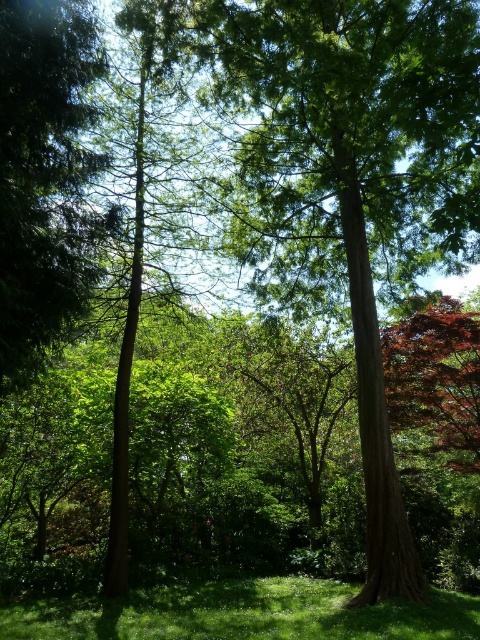
You are a hiker trying to determine which object is taller between the green leafy tree at left and the green grassy at lower center. Based on the scene, which one is taller?

The green leafy tree at left is taller than the green grassy at lower center.

You are standing in the forest and want to take a photo of the green leafy tree at left. Where should you position yourself to capture it in the frame?

To capture the green leafy tree at left in the frame, position yourself at the 2D location point closest to the coordinates provided for the tree, which is at point (x=43, y=172).